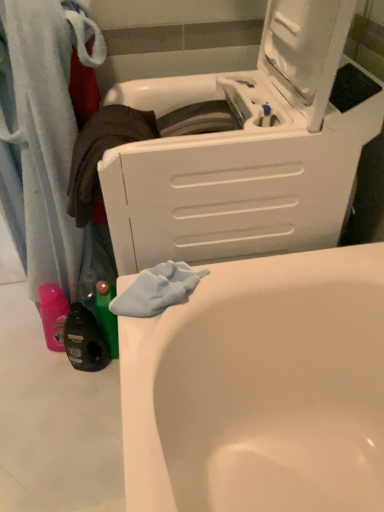
Question: Is white plastic washing machine at upper center spatially inside white glossy bathtub at lower left, or outside of it?

Choices:
 (A) inside
 (B) outside

Answer: (B)

Question: Considering the relative positions of white plastic washing machine at upper center and white glossy bathtub at lower left in the image provided, is white plastic washing machine at upper center to the left or to the right of white glossy bathtub at lower left?

Choices:
 (A) right
 (B) left

Answer: (A)

Question: Is white plastic washing machine at upper center wider or thinner than white glossy bathtub at lower left?

Choices:
 (A) wide
 (B) thin

Answer: (B)

Question: Is white glossy bathtub at lower left to the left or to the right of white plastic washing machine at upper center in the image?

Choices:
 (A) left
 (B) right

Answer: (A)

Question: From a real-world perspective, is white glossy bathtub at lower left above or below white plastic washing machine at upper center?

Choices:
 (A) below
 (B) above

Answer: (A)

Question: Considering the positions of point (215, 508) and point (352, 77), is point (215, 508) closer or farther from the camera than point (352, 77)?

Choices:
 (A) farther
 (B) closer

Answer: (A)

Question: From the image's perspective, relative to white plastic washing machine at upper center, is white glossy bathtub at lower left above or below?

Choices:
 (A) above
 (B) below

Answer: (B)